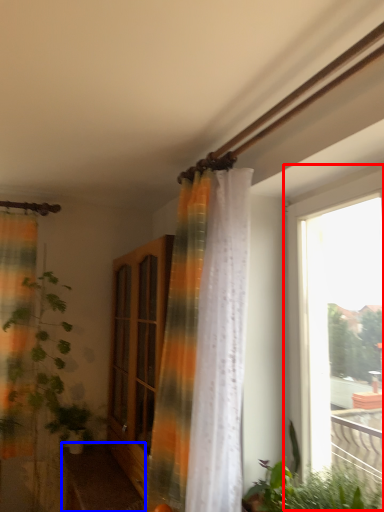
Question: Among these objects, which one is nearest to the camera, window (highlighted by a red box) or furniture (highlighted by a blue box)?

Choices:
 (A) window
 (B) furniture

Answer: (A)